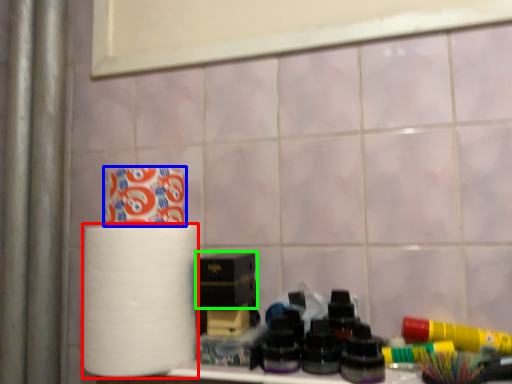
Question: Which object is the farthest from paper towel (highlighted by a red box)? Choose among these: toilet paper (highlighted by a blue box) or box (highlighted by a green box).

Choices:
 (A) toilet paper
 (B) box

Answer: (A)